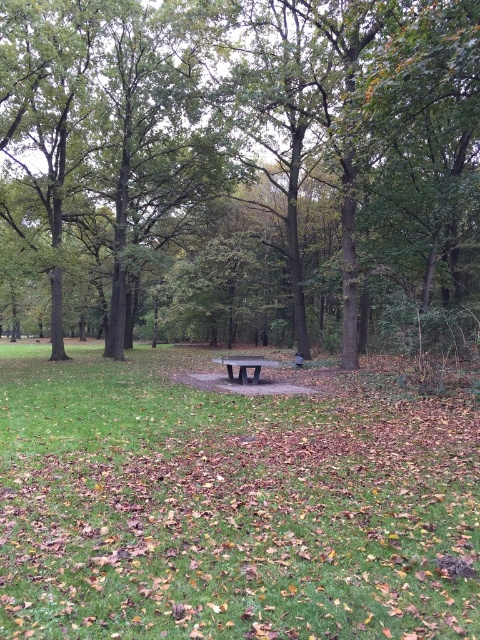
Consider the image. You are standing in the park and want to walk towards the picnic table. You notice two points marked on the ground at coordinates point [151,524] and point [248,365]. Which point should you step on first to reach the picnic table more quickly?

You should step on point [151,524] first because it is closer to the viewer than point [248,365], meaning it is nearer to your current position. This would allow you to reach the picnic table more quickly.

You are planning to sit on the benches in the park. Which bench, the wooden bench at center or the dark gray polished bench at center, is located to the right side of the other?

The wooden bench at center is positioned on the right side of the dark gray polished bench at center.

You are planning to sit on the bench in the park. The brown wood bench at center and the dark gray polished bench at center are both available. Which one is located higher up?

The brown wood bench at center is positioned over dark gray polished bench at center, so the brown wood bench at center is higher up.